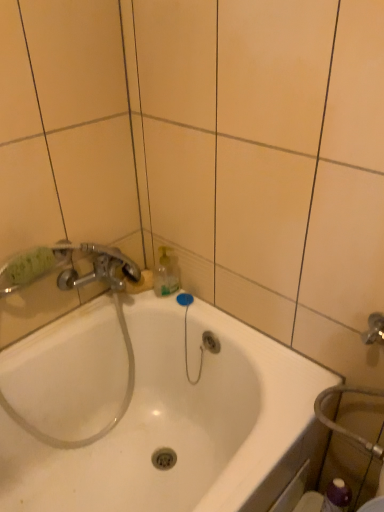
The width and height of the screenshot is (384, 512). What do you see at coordinates (151, 409) in the screenshot?
I see `white glossy bathtub at center` at bounding box center [151, 409].

Find the location of a particular element. The width and height of the screenshot is (384, 512). white glossy bathtub at center is located at coordinates (151, 409).

At what (x,y) coordinates should I click in order to perform the action: click on white glossy bathtub at center. Please return your answer as a coordinate pair (x, y). Looking at the image, I should click on (151, 409).